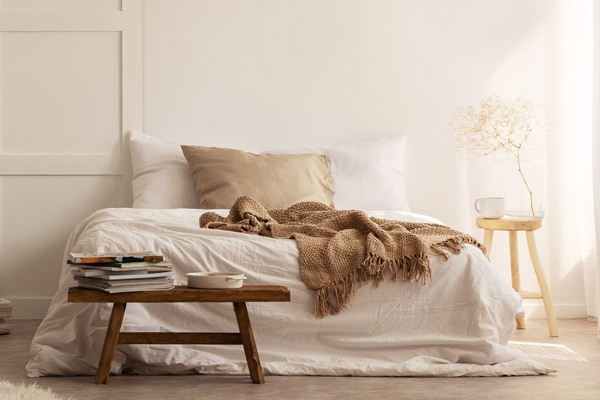
Find the location of a particular element. pillow is located at coordinates click(284, 169).